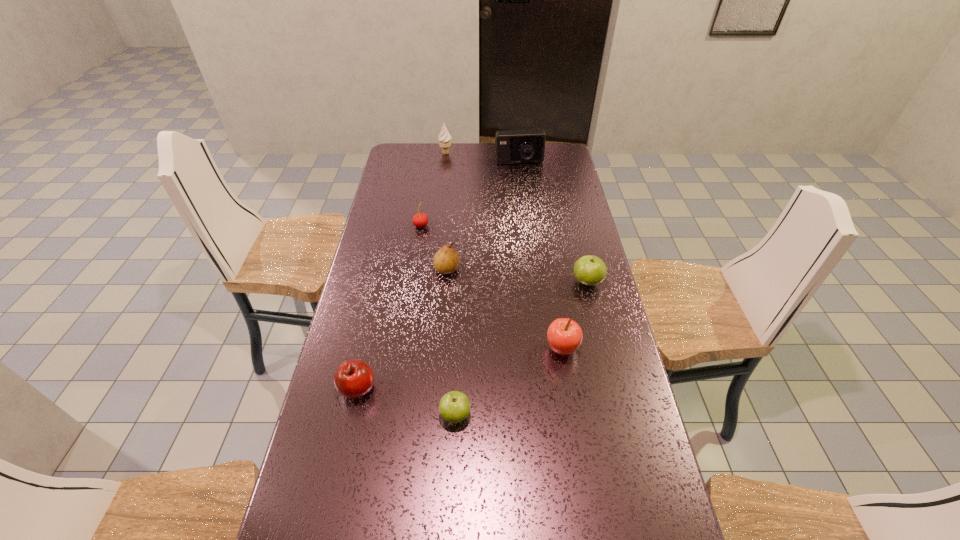
You are a GUI agent. You are given a task and a screenshot of the screen. Output one action in this format:
    pyautogui.click(x=<x>, y=<y>)
    Task: Click on the icecream
    
    Given the screenshot: What is the action you would take?
    pyautogui.click(x=444, y=138)

At what (x,y) coordinates should I click in order to perform the action: click on blue camera. Please return your answer as a coordinate pair (x, y). The image size is (960, 540). Looking at the image, I should click on (512, 146).

This screenshot has width=960, height=540. I want to click on the second farthest object, so click(x=512, y=146).

I want to click on brown pear, so click(x=446, y=261).

Where is `the farther green apple`? Image resolution: width=960 pixels, height=540 pixels. the farther green apple is located at coordinates (589, 270).

Where is `the rightmost apple`? The height and width of the screenshot is (540, 960). the rightmost apple is located at coordinates (589, 270).

Find the location of `the sixth farthest object`. the sixth farthest object is located at coordinates (564, 335).

Find the location of a particular element. This screenshot has width=960, height=540. the third nearest apple is located at coordinates (564, 335).

Find the location of a particular element. This screenshot has width=960, height=540. the left pink apple is located at coordinates (353, 378).

You are a GUI agent. You are given a task and a screenshot of the screen. Output one action in this format:
    pyautogui.click(x=<x>, y=<y>)
    Task: Click on the leftmost object
    This screenshot has height=540, width=960.
    Given the screenshot: What is the action you would take?
    pyautogui.click(x=353, y=378)